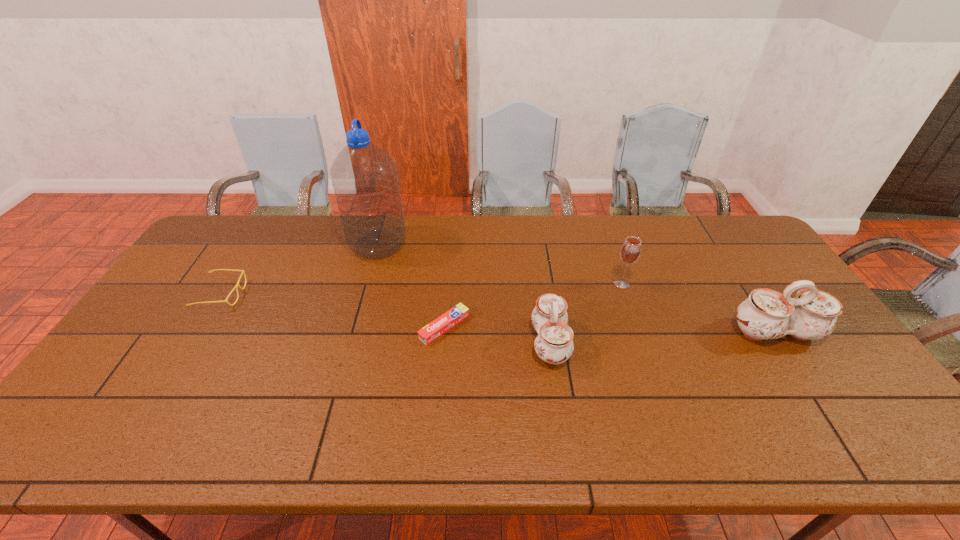
The height and width of the screenshot is (540, 960). I want to click on free point that keeps the chinawares evenly spaced on the left, so click(314, 354).